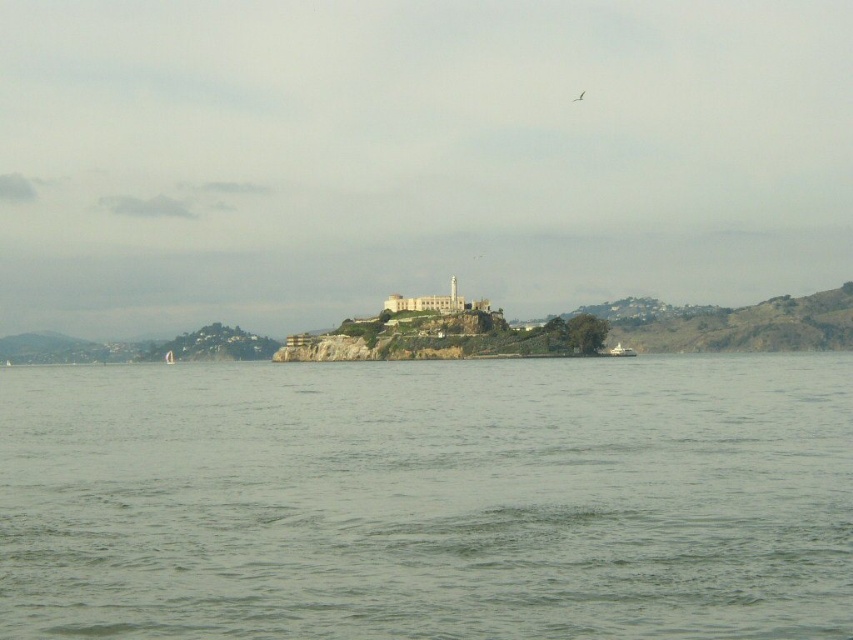
Question: In this image, where is gray water at center located relative to white matte boat at center?

Choices:
 (A) right
 (B) left

Answer: (B)

Question: Among these objects, which one is nearest to the camera?

Choices:
 (A) white plastic boat at center
 (B) white matte boat at center
 (C) gray water at center

Answer: (C)

Question: Is white stone castle at center closer to the viewer compared to white matte boat at center?

Choices:
 (A) no
 (B) yes

Answer: (A)

Question: Does white stone castle at center appear over white matte boat at center?

Choices:
 (A) yes
 (B) no

Answer: (A)

Question: Estimate the real-world distances between objects in this image. Which object is closer to the white matte boat at center?

Choices:
 (A) white stone castle at center
 (B) white plastic boat at center

Answer: (A)

Question: Which point is closer to the camera taking this photo?

Choices:
 (A) (631, 349)
 (B) (167, 349)
 (C) (173, 442)

Answer: (C)